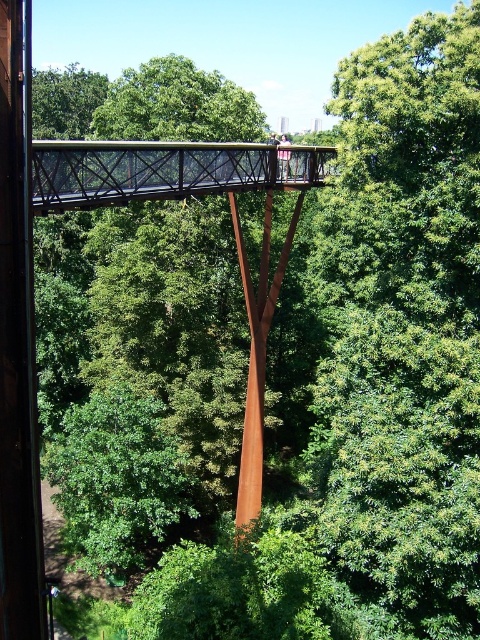
Question: Does rustic metal bridge at center lie in front of rusty metal pole at center?

Choices:
 (A) yes
 (B) no

Answer: (A)

Question: Is rustic metal bridge at center thinner than rusty metal pole at center?

Choices:
 (A) no
 (B) yes

Answer: (A)

Question: Is rustic metal bridge at center to the right of rusty metal pole at center from the viewer's perspective?

Choices:
 (A) no
 (B) yes

Answer: (A)

Question: Among these points, which one is nearest to the camera?

Choices:
 (A) (182, 170)
 (B) (236, 209)

Answer: (A)

Question: Which of the following is the closest to the observer?

Choices:
 (A) (239, 481)
 (B) (152, 172)

Answer: (B)